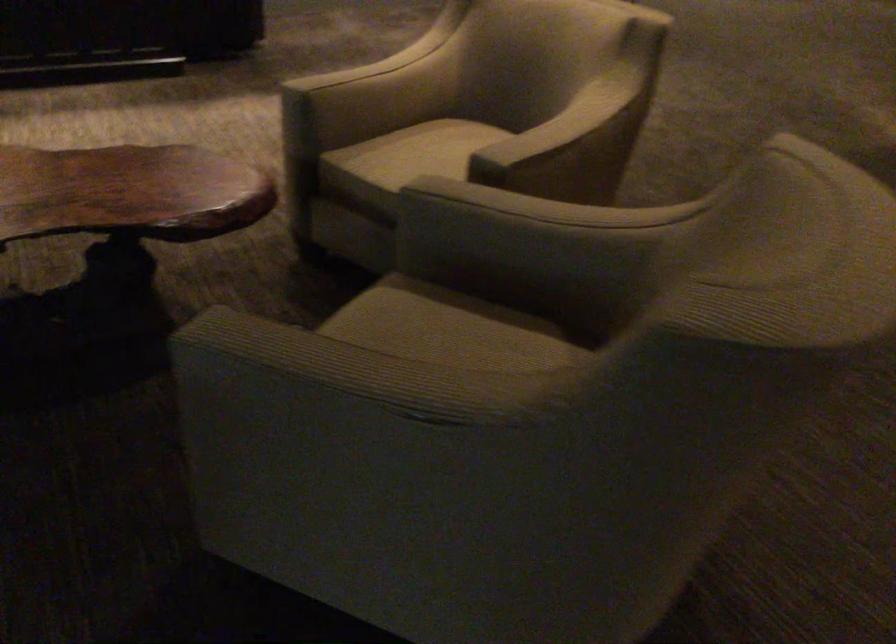
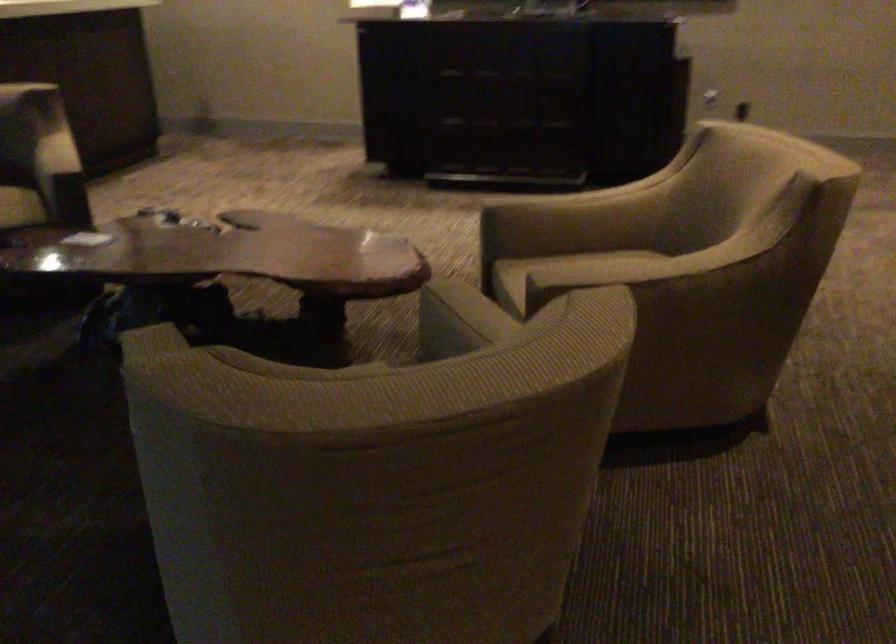
Locate, in the second image, the point that corresponds to [352,78] in the first image.

(547, 200)